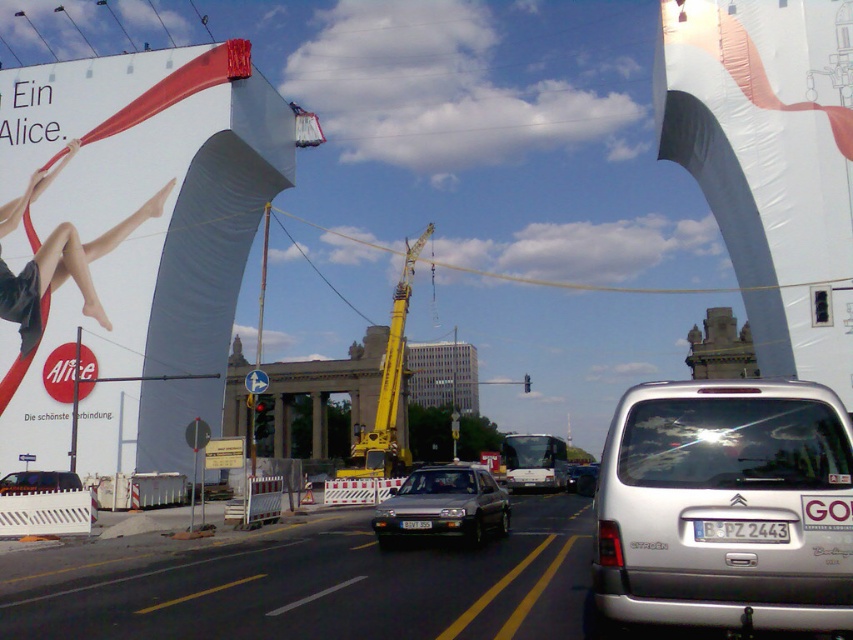
Based on the photo, you are a delivery driver who needs to park your vehicle in the area shown. Your vehicle has a white plastic license plate at center. There is also a black plastic license plate at center nearby. According to the scene, where exactly is your license plate located relative to the other one?

The white plastic license plate at center is to the right of the black plastic license plate at center.

You are a construction worker standing at the base of the yellow construction crane in the center. You need to reach the matte white banner at upper left to check its stability. Can you walk directly to it without needing to climb any structures?

The matte white banner at upper left is 44.15 meters away from the yellow construction crane in the center. Since this distance is quite large, you would need to walk directly to it without climbing any structures, but the distance might require some effort depending on the terrain.

You are a delivery driver who needs to park your 2.5m tall truck. You see the silver metallic van at center and the matte white fabric at upper left in the scene. Which object is shorter and can be safely passed under by your truck?

The silver metallic van at center is not as tall as the matte white fabric at upper left, so the truck can safely pass under the matte white fabric at upper left.